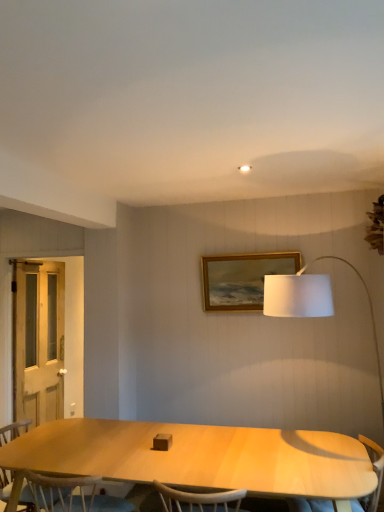
Question: Can you confirm if light wood armchair at lower right is thinner than white wooden screen door at left?

Choices:
 (A) no
 (B) yes

Answer: (A)

Question: Is light wood armchair at lower right taller than white wooden screen door at left?

Choices:
 (A) yes
 (B) no

Answer: (B)

Question: From a real-world perspective, is light wood armchair at lower right located higher than white wooden screen door at left?

Choices:
 (A) no
 (B) yes

Answer: (A)

Question: Is light wood armchair at lower right further to the viewer compared to white wooden screen door at left?

Choices:
 (A) no
 (B) yes

Answer: (A)

Question: Is white wooden screen door at left at the back of light wood armchair at lower right?

Choices:
 (A) yes
 (B) no

Answer: (B)

Question: Is light wood armchair at lower right placed right next to white wooden screen door at left?

Choices:
 (A) yes
 (B) no

Answer: (B)

Question: Considering the relative positions of gold wooden picture frame at upper center and light wood armchair at lower right in the image provided, is gold wooden picture frame at upper center to the right of light wood armchair at lower right from the viewer's perspective?

Choices:
 (A) yes
 (B) no

Answer: (B)

Question: From the image's perspective, does gold wooden picture frame at upper center appear higher than light wood armchair at lower right?

Choices:
 (A) yes
 (B) no

Answer: (A)

Question: Can you confirm if gold wooden picture frame at upper center is shorter than light wood armchair at lower right?

Choices:
 (A) no
 (B) yes

Answer: (B)

Question: Does gold wooden picture frame at upper center have a larger size compared to light wood armchair at lower right?

Choices:
 (A) yes
 (B) no

Answer: (B)

Question: Can you confirm if gold wooden picture frame at upper center is smaller than light wood armchair at lower right?

Choices:
 (A) no
 (B) yes

Answer: (B)

Question: Can you confirm if gold wooden picture frame at upper center is taller than light wood armchair at lower right?

Choices:
 (A) yes
 (B) no

Answer: (B)

Question: Can you confirm if gold wooden picture frame at upper center is smaller than white wooden screen door at left?

Choices:
 (A) yes
 (B) no

Answer: (A)